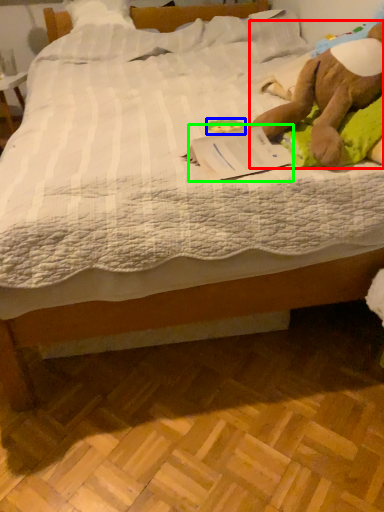
Question: Considering the real-world distances, which object is closest to animal (highlighted by a red box)? toy (highlighted by a blue box) or paperback book (highlighted by a green box).

Choices:
 (A) toy
 (B) paperback book

Answer: (B)